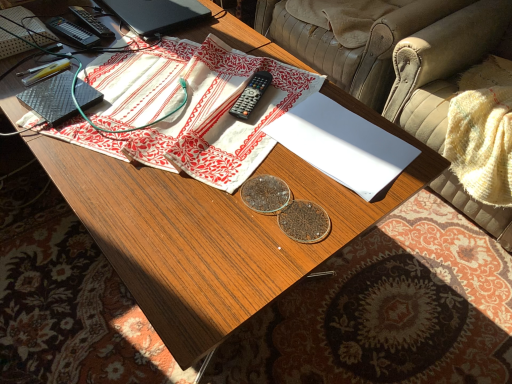
The height and width of the screenshot is (384, 512). Find the location of `vacant area situated below white cotton cloth at center (from a real-world perspective)`. vacant area situated below white cotton cloth at center (from a real-world perspective) is located at coordinates (156, 94).